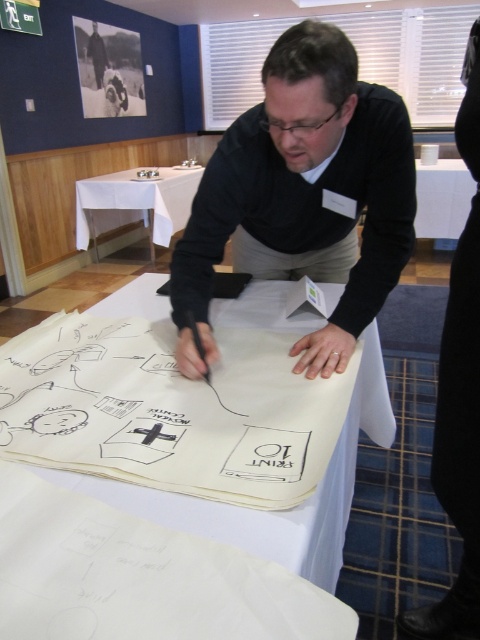
The image size is (480, 640). I want to click on black matte sweater at center, so click(x=303, y=195).

Does black matte sweater at center appear over white cloth at upper left?

Incorrect, black matte sweater at center is not positioned above white cloth at upper left.

The height and width of the screenshot is (640, 480). Describe the element at coordinates (303, 195) in the screenshot. I see `black matte sweater at center` at that location.

I want to click on black matte sweater at center, so click(303, 195).

Does white paper at center appear on the left side of white cloth at upper left?

In fact, white paper at center is to the right of white cloth at upper left.

Does white paper at center lie behind white cloth at upper left?

No, white paper at center is closer to the viewer.

Image resolution: width=480 pixels, height=640 pixels. What are the coordinates of `white paper at center` in the screenshot? It's located at (264, 509).

Does black matte sweater at center have a lesser width compared to white paper at center?

Yes.

In the scene shown: Between black matte sweater at center and white paper at center, which one appears on the left side from the viewer's perspective?

white paper at center is more to the left.

Is point (304, 348) less distant than point (373, 344)?

Yes, it is in front of point (373, 344).

The width and height of the screenshot is (480, 640). I want to click on black matte sweater at center, so click(x=303, y=195).